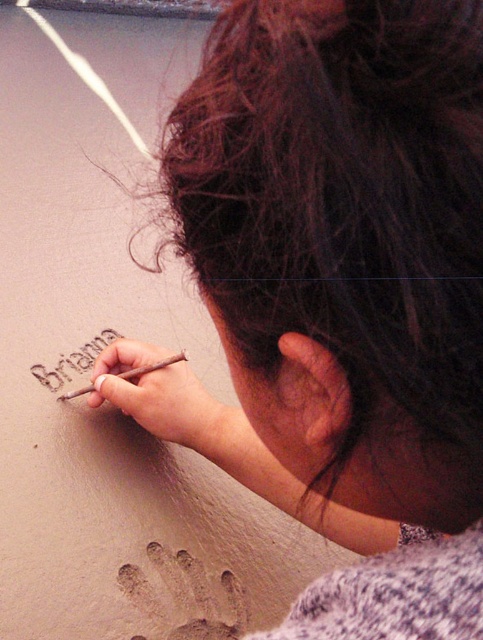
Question: Can you confirm if brown clay name at center is positioned to the right of brown wooden pencil at lower left?

Choices:
 (A) no
 (B) yes

Answer: (A)

Question: Is smooth wooden pencil at center above brown wooden pencil at lower left?

Choices:
 (A) no
 (B) yes

Answer: (A)

Question: Which point appears closest to the camera in this image?

Choices:
 (A) [x=91, y=339]
 (B) [x=86, y=388]
 (C) [x=167, y=388]

Answer: (C)

Question: Among these objects, which one is nearest to the camera?

Choices:
 (A) brown clay name at center
 (B) smooth wooden pencil at center
 (C) brown wooden pencil at lower left

Answer: (B)

Question: Which of these objects is positioned farthest from the brown clay name at center?

Choices:
 (A) smooth wooden pencil at center
 (B) brown wooden pencil at lower left

Answer: (A)

Question: Is the position of smooth wooden pencil at center more distant than that of brown wooden pencil at lower left?

Choices:
 (A) yes
 (B) no

Answer: (B)